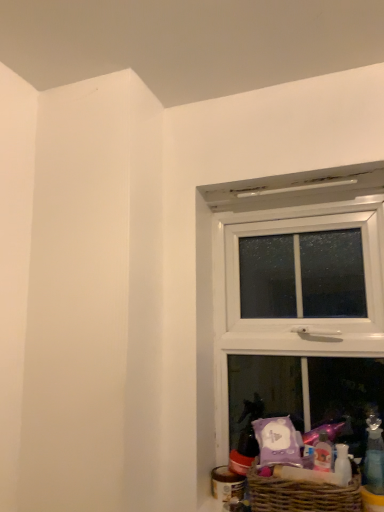
Where is `white plastic window at upper right`? The height and width of the screenshot is (512, 384). white plastic window at upper right is located at coordinates (288, 298).

From the picture: Which object is closer to the camera taking this photo, brown wicker basket at lower right or transparent plastic bottle at lower right?

Positioned in front is brown wicker basket at lower right.

Does point (256, 486) appear closer or farther from the camera than point (380, 440)?

Point (256, 486) appears to be closer to the viewer than point (380, 440).

From the image's perspective, which object appears higher, brown wicker basket at lower right or transparent plastic bottle at lower right?

transparent plastic bottle at lower right appears higher in the image.

Which object is positioned more to the right, brown wicker basket at lower right or transparent plastic bottle at lower right?

Positioned to the right is transparent plastic bottle at lower right.

Would you consider white plastic window at upper right to be distant from transparent plastic bottle at lower right?

That's not correct — white plastic window at upper right is a little close to transparent plastic bottle at lower right.

From the picture: Which of these two, white plastic window at upper right or transparent plastic bottle at lower right, stands shorter?

transparent plastic bottle at lower right is shorter.

What's the angular difference between white plastic window at upper right and transparent plastic bottle at lower right's facing directions?

The angle between the facing direction of white plastic window at upper right and the facing direction of transparent plastic bottle at lower right is 0.34 degrees.

Measure the distance between white plastic window at upper right and transparent plastic bottle at lower right.

18.78 inches.

Which is closer, (x=353, y=506) or (x=229, y=251)?

The point (x=353, y=506) is more forward.

Is brown wicker basket at lower right oriented towards white plastic window at upper right?

No, brown wicker basket at lower right is not oriented towards white plastic window at upper right.

Between brown wicker basket at lower right and white plastic window at upper right, which one has less height?

brown wicker basket at lower right.

From the picture: Considering the sizes of brown wicker basket at lower right and white plastic window at upper right in the image, is brown wicker basket at lower right bigger or smaller than white plastic window at upper right?

brown wicker basket at lower right is smaller than white plastic window at upper right.

Considering the positions of objects transparent plastic bottle at lower right and white plastic window at upper right in the image provided, who is more to the right, transparent plastic bottle at lower right or white plastic window at upper right?

From the viewer's perspective, transparent plastic bottle at lower right appears more on the right side.

Considering the points (371, 461) and (355, 241), which point is behind, point (371, 461) or point (355, 241)?

Point (355, 241)

Considering the sizes of objects transparent plastic bottle at lower right and brown wicker basket at lower right in the image provided, who is thinner, transparent plastic bottle at lower right or brown wicker basket at lower right?

transparent plastic bottle at lower right is thinner.

Considering the positions of objects transparent plastic bottle at lower right and brown wicker basket at lower right in the image provided, who is more to the left, transparent plastic bottle at lower right or brown wicker basket at lower right?

From the viewer's perspective, brown wicker basket at lower right appears more on the left side.

From the image's perspective, between transparent plastic bottle at lower right and brown wicker basket at lower right, who is located below?

From the image's view, brown wicker basket at lower right is below.

Based on the photo, could brown wicker basket at lower right be considered to be inside transparent plastic bottle at lower right?

No, brown wicker basket at lower right is not a part of transparent plastic bottle at lower right.

From a real-world perspective, is white plastic window at upper right under brown wicker basket at lower right?

No, from a real-world perspective, white plastic window at upper right is not under brown wicker basket at lower right.

Is white plastic window at upper right facing towards brown wicker basket at lower right?

Yes, white plastic window at upper right is turned towards brown wicker basket at lower right.

Find the location of a particular element. This screenshot has height=512, width=384. toiletry above the brown wicker basket at lower right (from the image's perspective) is located at coordinates (374, 456).

This screenshot has width=384, height=512. What are the coordinates of `toiletry that appears below the white plastic window at upper right (from a real-world perspective)` in the screenshot? It's located at (374, 456).

Estimate the real-world distances between objects in this image. Which object is further from transparent plastic bottle at lower right, brown wicker basket at lower right or white plastic window at upper right?

white plastic window at upper right.

Which object lies nearer to the anchor point transparent plastic bottle at lower right, white plastic window at upper right or brown wicker basket at lower right?

brown wicker basket at lower right is closer to transparent plastic bottle at lower right.

Which object lies nearer to the anchor point brown wicker basket at lower right, white plastic window at upper right or transparent plastic bottle at lower right?

The object closer to brown wicker basket at lower right is transparent plastic bottle at lower right.

Consider the image. From the image, which object appears to be nearer to brown wicker basket at lower right, transparent plastic bottle at lower right or white plastic window at upper right?

transparent plastic bottle at lower right lies closer to brown wicker basket at lower right than the other object.

When comparing their distances from white plastic window at upper right, does brown wicker basket at lower right or transparent plastic bottle at lower right seem closer?

brown wicker basket at lower right lies closer to white plastic window at upper right than the other object.

Estimate the real-world distances between objects in this image. Which object is closer to white plastic window at upper right, transparent plastic bottle at lower right or brown wicker basket at lower right?

brown wicker basket at lower right.

The height and width of the screenshot is (512, 384). I want to click on toiletry that lies between white plastic window at upper right and brown wicker basket at lower right from top to bottom, so click(x=374, y=456).